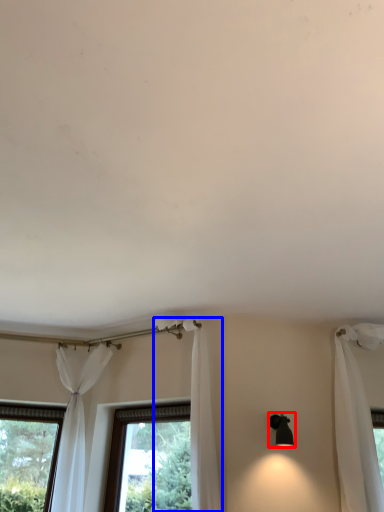
Question: Among these objects, which one is farthest to the camera, light fixture (highlighted by a red box) or curtain (highlighted by a blue box)?

Choices:
 (A) light fixture
 (B) curtain

Answer: (A)